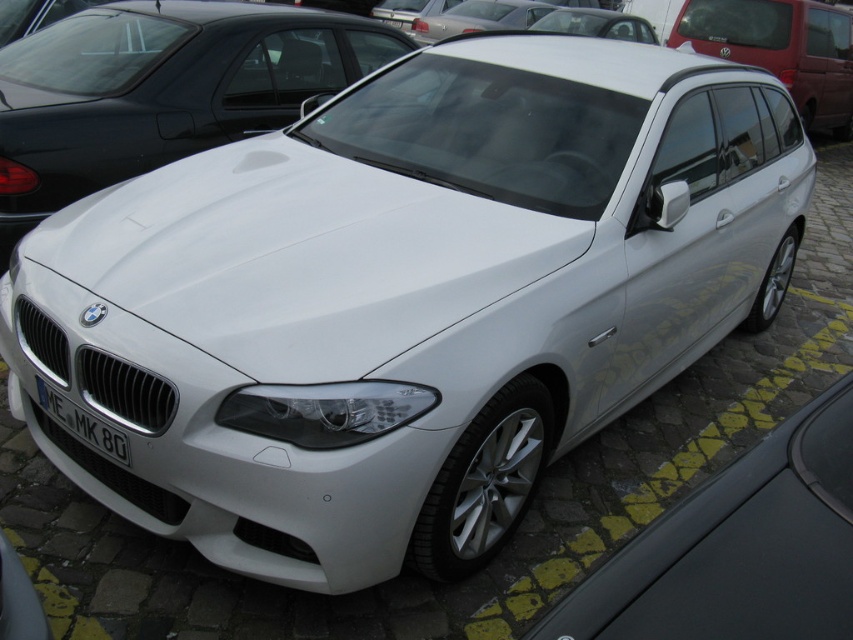
Is white glossy car at upper right below white plastic license plate at center?

No.

Who is taller, white glossy car at upper right or white plastic license plate at center?

Standing taller between the two is white glossy car at upper right.

The image size is (853, 640). What are the coordinates of `white glossy car at upper right` in the screenshot? It's located at (770, 45).

Is point (264, 104) positioned after point (126, 465)?

Yes, point (264, 104) is behind point (126, 465).

Locate an element on the screen. This screenshot has width=853, height=640. white glossy car at center is located at coordinates point(160,90).

The width and height of the screenshot is (853, 640). I want to click on white glossy car at center, so click(160, 90).

Locate an element on the screen. The image size is (853, 640). white glossy car at center is located at coordinates (160, 90).

Between white glossy car at center and white matte car at center, which one appears on the right side from the viewer's perspective?

From the viewer's perspective, white matte car at center appears more on the right side.

Is point (32, 113) farther from viewer compared to point (813, 461)?

Yes, point (32, 113) is farther from viewer.

The width and height of the screenshot is (853, 640). What do you see at coordinates (160, 90) in the screenshot?
I see `white glossy car at center` at bounding box center [160, 90].

You are a GUI agent. You are given a task and a screenshot of the screen. Output one action in this format:
    pyautogui.click(x=<x>, y=<y>)
    Task: Click on the white glossy car at center
    Image resolution: width=853 pixels, height=640 pixels.
    Given the screenshot: What is the action you would take?
    pyautogui.click(x=160, y=90)